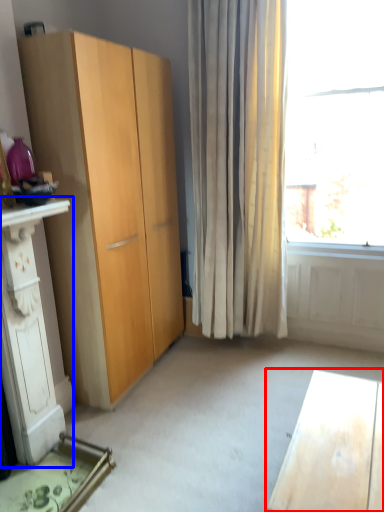
Question: Which object appears farthest to the camera in this image, desk (highlighted by a red box) or dresser (highlighted by a blue box)?

Choices:
 (A) desk
 (B) dresser

Answer: (B)